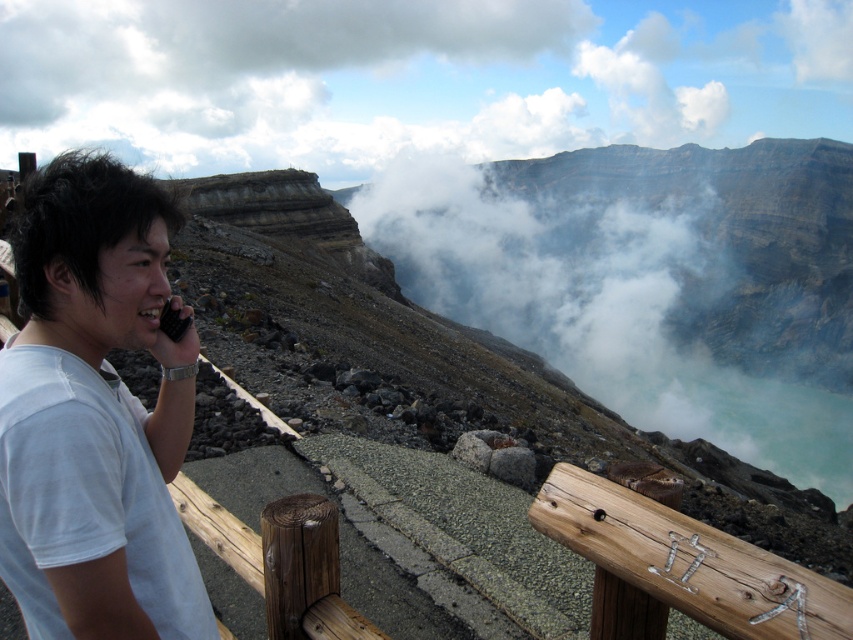
You are a photographer positioned at the center of the scene. You want to take a photo of the white cotton shirt at left. Where should you aim your camera to capture it in the frame?

You should aim your camera at the point with coordinates (x=96, y=413), as the white cotton shirt at left is located there.

You are a photographer trying to capture a closeup of the white cotton shirt at left and the black plastic phone at left in the scene. Which object should you zoom in on to ensure both are in frame without moving the camera?

You should zoom in on the white cotton shirt at left because it is wider than the black plastic phone at left, allowing both to fit within the frame when focusing on the wider object.

You are a photographer trying to capture a clear photo of the black plastic phone at left. However, the white cotton shirt at left is blocking your view. Can you see the phone clearly?

The white cotton shirt at left is in front of the black plastic phone at left, so the phone is blocked and cannot be seen clearly.